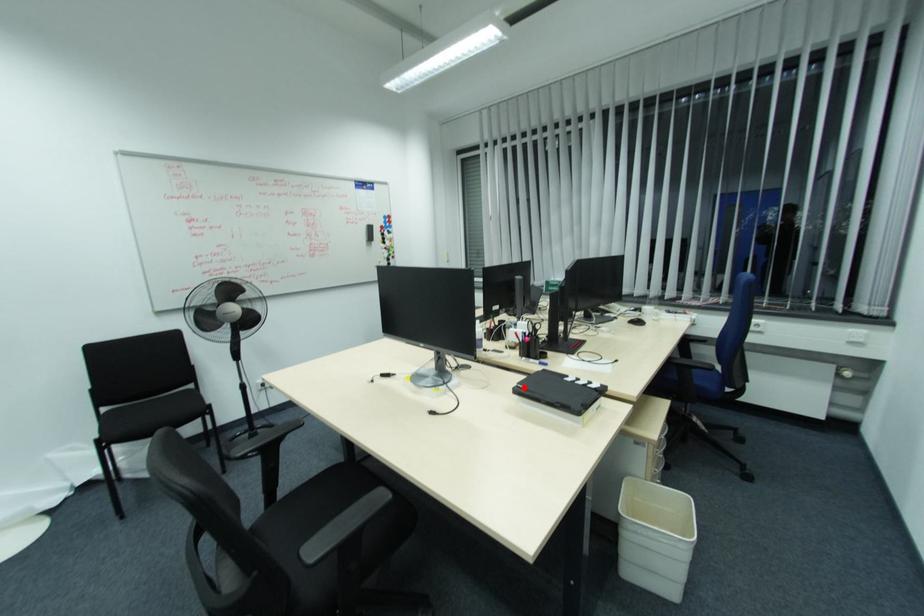
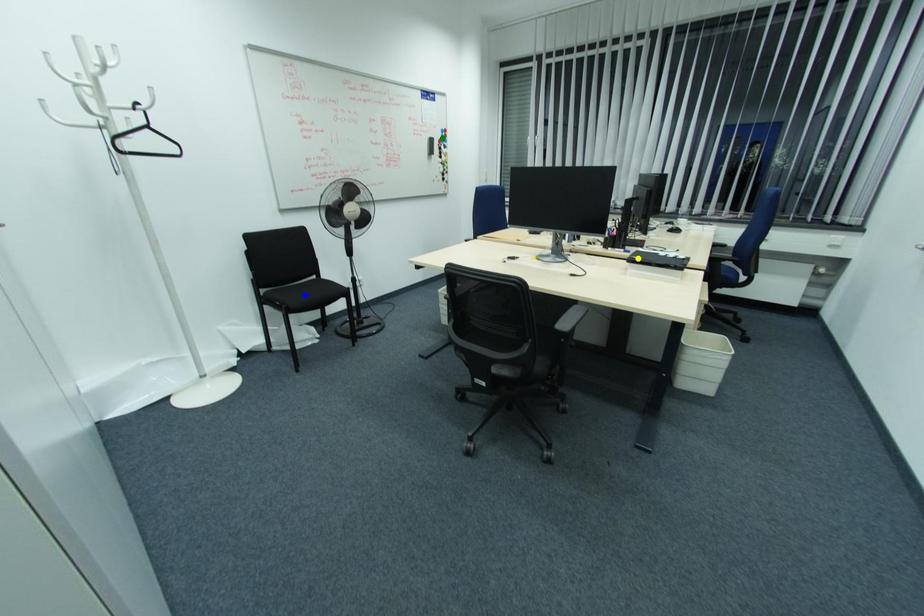
Question: I am providing you with two images of the same scene from different viewpoints. A red point is marked on the first image. You are given multiple points on the second image. Which point in image 2 is actually the same real-world point as the red point in image 1?

Choices:
 (A) green point
 (B) blue point
 (C) yellow point

Answer: (C)